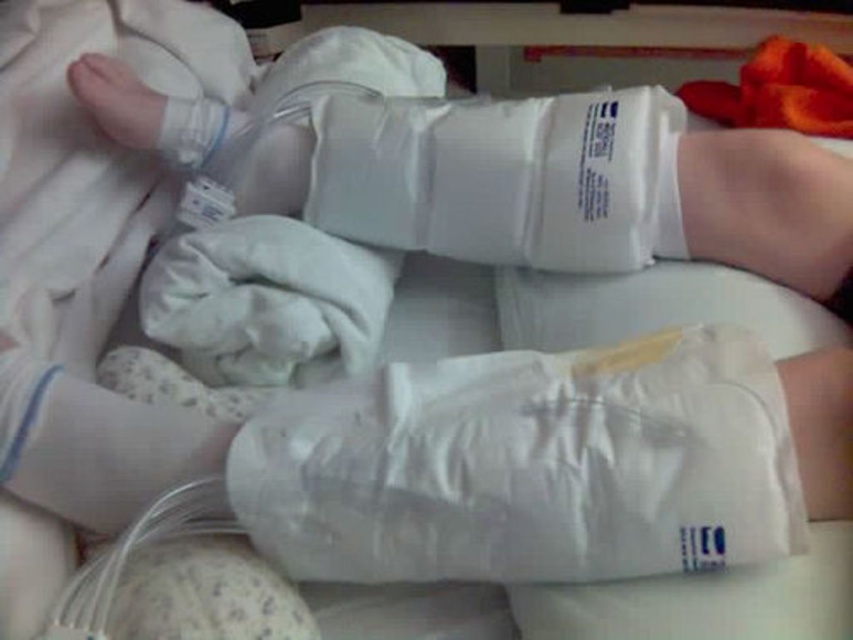
You are a nurse in a hospital. You need to place a medical label on the white matte bandage at center. According to the image, where exactly should you place the label?

The white matte bandage at center is located at point [503,177], so you should place the label there.

You are a medical student observing a patient in a hospital room. You notice two points marked on the gauze bandages on the patient arms. The first point is at coordinate point [463,228] and the second point is at coordinate point [131,106]. Which point is closer to the viewer?

Point [463,228] is further to the viewer than point [131,106], so the second point is closer to the viewer.

You are a nurse preparing to check the patient in the image. You see the white matte bandage at center and the white smooth foot at upper left. Which object is located to the right side of the other?

The white matte bandage at center is to the right of the white smooth foot at upper left.